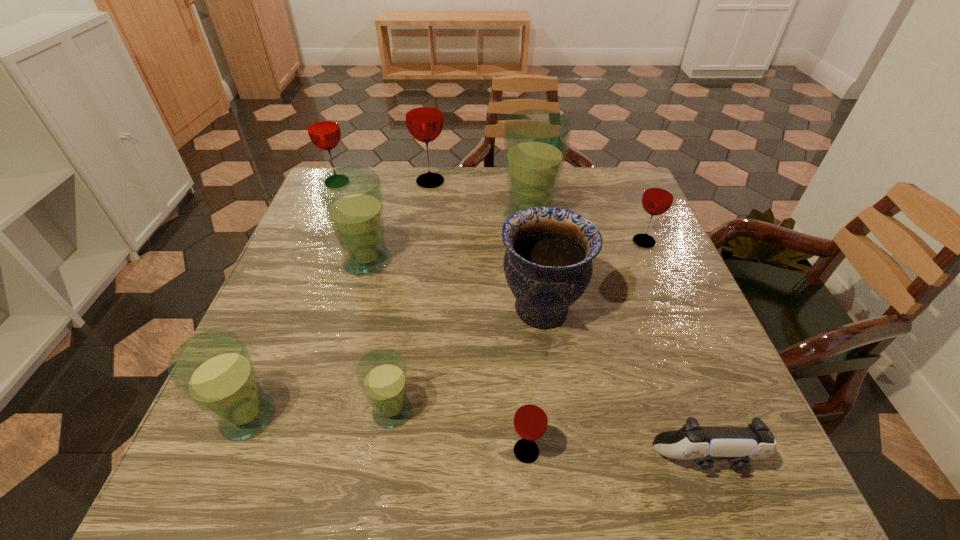
You are a GUI agent. You are given a task and a screenshot of the screen. Output one action in this format:
    pyautogui.click(x=<x>, y=<y>)
    Task: Click on the object present at the near right corner
    Image resolution: width=960 pixels, height=540 pixels.
    Given the screenshot: What is the action you would take?
    pyautogui.click(x=738, y=445)

Locate an element on the screen. free space at the far edge is located at coordinates (503, 173).

Image resolution: width=960 pixels, height=540 pixels. What are the coordinates of `vacant space at the near edge` in the screenshot? It's located at (624, 449).

Locate an element on the screen. The image size is (960, 540). vacant space at the left edge is located at coordinates (308, 327).

You are a GUI agent. You are given a task and a screenshot of the screen. Output one action in this format:
    pyautogui.click(x=<x>, y=<y>)
    Task: Click on the free space at the right edge
    The width and height of the screenshot is (960, 540).
    Given the screenshot: What is the action you would take?
    pyautogui.click(x=670, y=364)

This screenshot has width=960, height=540. Identify the location of vacant area at the near left corner of the desktop. (265, 476).

In the image, there is a desktop. At what (x,y) coordinates should I click in order to perform the action: click on vacant area at the far right corner. Please return your answer as a coordinate pair (x, y). The image size is (960, 540). Looking at the image, I should click on (609, 195).

Locate an element on the screen. Image resolution: width=960 pixels, height=540 pixels. free spot between the pottery and the shortest object is located at coordinates (623, 385).

This screenshot has width=960, height=540. I want to click on free area in between the third blue glass from left to right and the smallest red glass, so click(459, 431).

Find the location of a particular element. This screenshot has width=960, height=540. free space between the sixth glass from right to left and the nearest red glass is located at coordinates (446, 356).